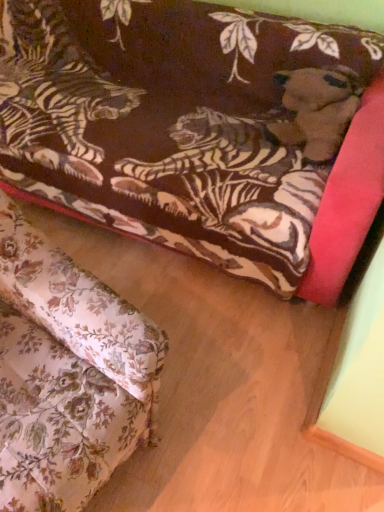
Question: Which direction should I rotate to look at velvet tiger-patterned couch at upper center, which ranks as the first studio couch in back-to-front order?

Choices:
 (A) right
 (B) left

Answer: (B)

Question: Can you confirm if velvet tiger-patterned couch at upper center, arranged as the 2th studio couch when viewed from the back, is wider than velvet tiger-patterned couch at upper center, which ranks as the first studio couch in back-to-front order?

Choices:
 (A) no
 (B) yes

Answer: (A)

Question: Is velvet tiger-patterned couch at upper center, which ranks as the first studio couch in front-to-back order, far away from velvet tiger-patterned couch at upper center, which ranks as the first studio couch in back-to-front order?

Choices:
 (A) yes
 (B) no

Answer: (B)

Question: Can you confirm if velvet tiger-patterned couch at upper center, which ranks as the first studio couch in front-to-back order, is thinner than velvet tiger-patterned couch at upper center, which is the second studio couch in front-to-back order?

Choices:
 (A) no
 (B) yes

Answer: (B)

Question: Is velvet tiger-patterned couch at upper center, which ranks as the first studio couch in back-to-front order, at the back of velvet tiger-patterned couch at upper center, which ranks as the first studio couch in front-to-back order?

Choices:
 (A) yes
 (B) no

Answer: (B)

Question: Considering the relative positions of velvet tiger-patterned couch at upper center, which ranks as the first studio couch in front-to-back order, and velvet tiger-patterned couch at upper center, which is the second studio couch in front-to-back order, in the image provided, is velvet tiger-patterned couch at upper center, which ranks as the first studio couch in front-to-back order, to the right of velvet tiger-patterned couch at upper center, which is the second studio couch in front-to-back order, from the viewer's perspective?

Choices:
 (A) yes
 (B) no

Answer: (B)

Question: From the image's perspective, is velvet tiger-patterned couch at upper center, which ranks as the first studio couch in front-to-back order, below velvet tiger-patterned couch at upper center, which ranks as the first studio couch in back-to-front order?

Choices:
 (A) yes
 (B) no

Answer: (A)

Question: Can you confirm if velvet tiger-patterned couch at upper center, which is the second studio couch in front-to-back order, is shorter than velvet tiger-patterned couch at upper center, which ranks as the first studio couch in front-to-back order?

Choices:
 (A) yes
 (B) no

Answer: (A)

Question: Is velvet tiger-patterned couch at upper center, which ranks as the first studio couch in back-to-front order, positioned with its back to velvet tiger-patterned couch at upper center, arranged as the 2th studio couch when viewed from the back?

Choices:
 (A) no
 (B) yes

Answer: (A)

Question: Can you confirm if velvet tiger-patterned couch at upper center, which ranks as the first studio couch in back-to-front order, is wider than velvet tiger-patterned couch at upper center, arranged as the 2th studio couch when viewed from the back?

Choices:
 (A) yes
 (B) no

Answer: (A)

Question: Does velvet tiger-patterned couch at upper center, which is the second studio couch in front-to-back order, appear on the left side of velvet tiger-patterned couch at upper center, which ranks as the first studio couch in front-to-back order?

Choices:
 (A) yes
 (B) no

Answer: (B)

Question: Is velvet tiger-patterned couch at upper center, which ranks as the first studio couch in back-to-front order, positioned beyond the bounds of velvet tiger-patterned couch at upper center, which ranks as the first studio couch in front-to-back order?

Choices:
 (A) yes
 (B) no

Answer: (A)

Question: Is velvet tiger-patterned couch at upper center, which ranks as the first studio couch in back-to-front order, oriented towards velvet tiger-patterned couch at upper center, arranged as the 2th studio couch when viewed from the back?

Choices:
 (A) yes
 (B) no

Answer: (A)

Question: Considering the positions of velvet tiger-patterned couch at upper center, which is the second studio couch in front-to-back order, and velvet tiger-patterned couch at upper center, arranged as the 2th studio couch when viewed from the back, in the image, is velvet tiger-patterned couch at upper center, which is the second studio couch in front-to-back order, wider or thinner than velvet tiger-patterned couch at upper center, arranged as the 2th studio couch when viewed from the back,?

Choices:
 (A) thin
 (B) wide

Answer: (B)